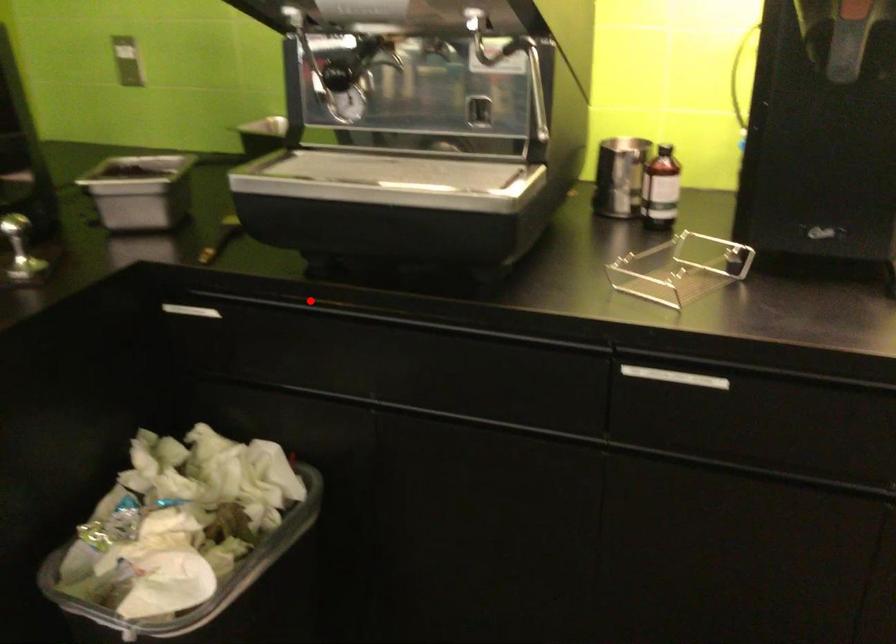
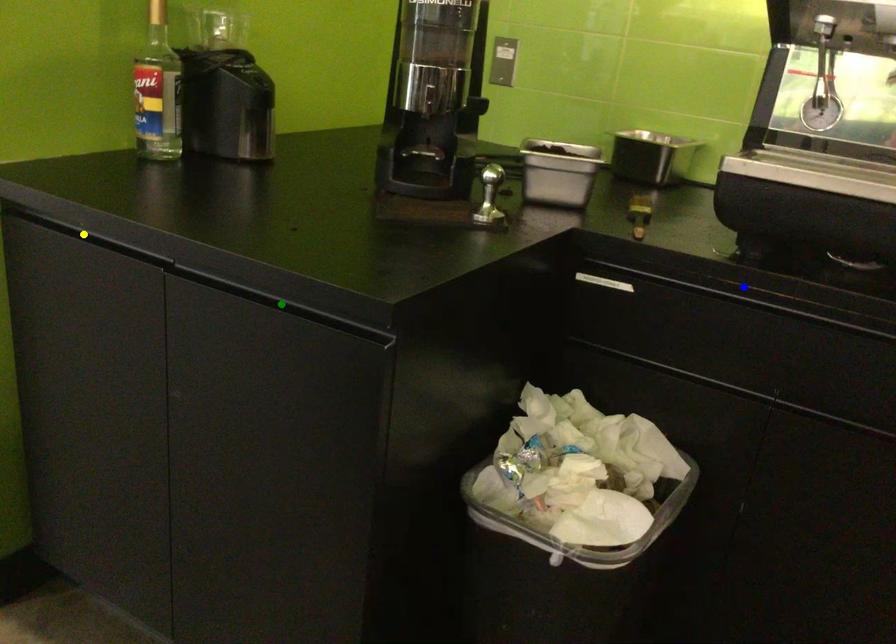
Question: I am providing you with two images of the same scene from different viewpoints. A red point is marked on the first image. You are given multiple points on the second image. In image 2, which mark is for the same physical point as the one in image 1?

Choices:
 (A) green point
 (B) blue point
 (C) yellow point

Answer: (B)